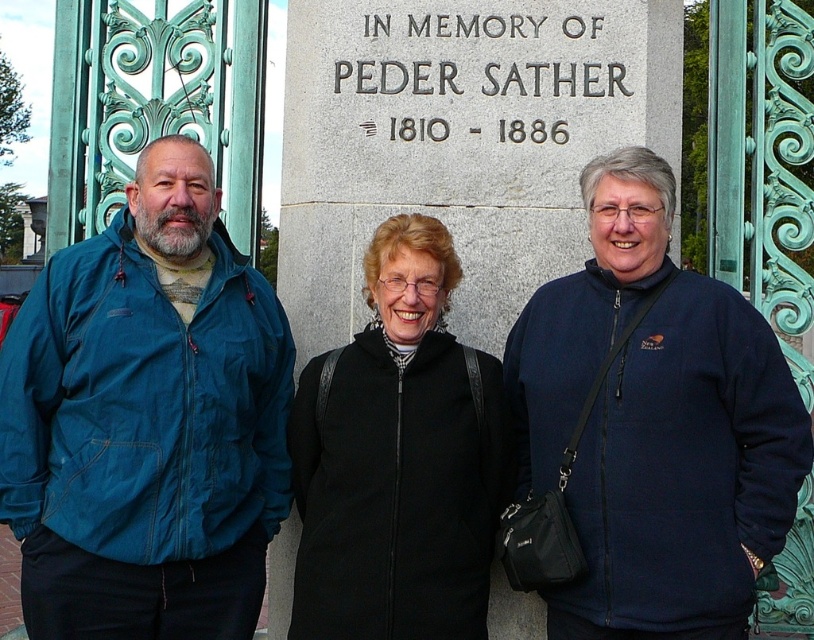
You are a photographer trying to capture a group photo of the blue fabric jacket at left and the navy fleece jacket at center. You want to ensure both jackets are clearly visible in the frame. Based on their sizes, which jacket should you focus on to ensure both are in focus?

The blue fabric jacket at left might be wider than navy fleece jacket at center, so focusing on the wider jacket would help ensure both are in focus.